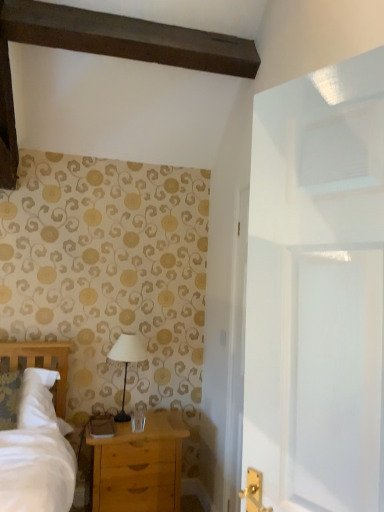
Question: Is white fabric lampshade at center to the left or to the right of light brown wooden chest of drawers at lower left in the image?

Choices:
 (A) left
 (B) right

Answer: (A)

Question: From a real-world perspective, relative to light brown wooden chest of drawers at lower left, is white fabric lampshade at center vertically above or below?

Choices:
 (A) above
 (B) below

Answer: (A)

Question: Is white fabric lampshade at center bigger or smaller than light brown wooden chest of drawers at lower left?

Choices:
 (A) small
 (B) big

Answer: (A)

Question: From a real-world perspective, is light brown wooden chest of drawers at lower left positioned above or below white fabric lampshade at center?

Choices:
 (A) above
 (B) below

Answer: (B)

Question: In terms of height, does light brown wooden chest of drawers at lower left look taller or shorter compared to white fabric lampshade at center?

Choices:
 (A) short
 (B) tall

Answer: (B)

Question: Considering the positions of point (160, 487) and point (125, 372), is point (160, 487) closer or farther from the camera than point (125, 372)?

Choices:
 (A) farther
 (B) closer

Answer: (B)

Question: Considering the relative positions of light brown wooden chest of drawers at lower left and white fabric lampshade at center in the image provided, is light brown wooden chest of drawers at lower left to the left or to the right of white fabric lampshade at center?

Choices:
 (A) right
 (B) left

Answer: (A)